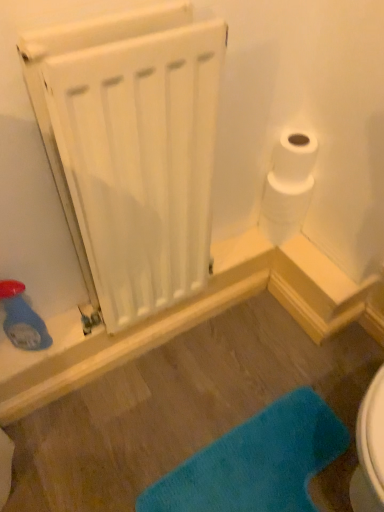
Question: Should I look upward or downward to see white matte radiator at upper left?

Choices:
 (A) up
 (B) down

Answer: (A)

Question: Considering the relative sizes of white matte toilet paper at upper right and blue fuzzy bath mat at lower center in the image provided, is white matte toilet paper at upper right taller than blue fuzzy bath mat at lower center?

Choices:
 (A) yes
 (B) no

Answer: (A)

Question: Is white matte toilet paper at upper right further to the viewer compared to blue fuzzy bath mat at lower center?

Choices:
 (A) yes
 (B) no

Answer: (A)

Question: Is white matte toilet paper at upper right at the left side of blue fuzzy bath mat at lower center?

Choices:
 (A) no
 (B) yes

Answer: (A)

Question: Can you confirm if white matte toilet paper at upper right is smaller than blue fuzzy bath mat at lower center?

Choices:
 (A) yes
 (B) no

Answer: (A)

Question: Considering the relative positions of white matte toilet paper at upper right and blue fuzzy bath mat at lower center in the image provided, is white matte toilet paper at upper right in front of blue fuzzy bath mat at lower center?

Choices:
 (A) yes
 (B) no

Answer: (B)

Question: From a real-world perspective, is white matte toilet paper at upper right under blue fuzzy bath mat at lower center?

Choices:
 (A) no
 (B) yes

Answer: (A)

Question: From a real-world perspective, is blue fuzzy bath mat at lower center physically below white matte toilet paper at upper right?

Choices:
 (A) yes
 (B) no

Answer: (A)

Question: Is blue fuzzy bath mat at lower center outside white matte toilet paper at upper right?

Choices:
 (A) no
 (B) yes

Answer: (B)

Question: From a real-world perspective, is blue fuzzy bath mat at lower center over white matte toilet paper at upper right?

Choices:
 (A) yes
 (B) no

Answer: (B)

Question: Is blue fuzzy bath mat at lower center placed right next to white matte toilet paper at upper right?

Choices:
 (A) no
 (B) yes

Answer: (A)

Question: Considering the relative positions of blue fuzzy bath mat at lower center and white matte toilet paper at upper right in the image provided, is blue fuzzy bath mat at lower center to the right of white matte toilet paper at upper right from the viewer's perspective?

Choices:
 (A) yes
 (B) no

Answer: (B)

Question: Does blue fuzzy bath mat at lower center appear on the left side of white matte toilet paper at upper right?

Choices:
 (A) yes
 (B) no

Answer: (A)

Question: Does white matte toilet paper at upper right appear on the left side of white matte radiator at upper left?

Choices:
 (A) yes
 (B) no

Answer: (B)